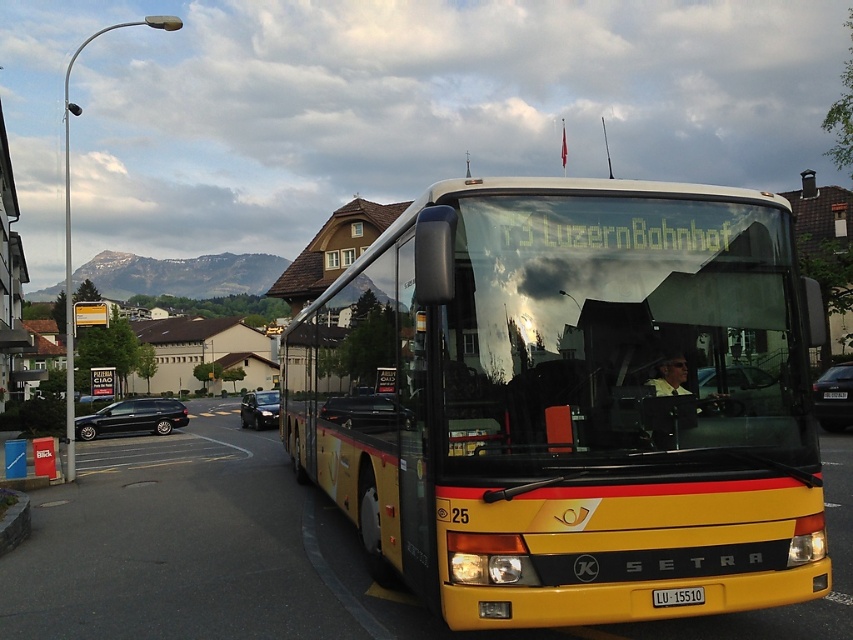
Between yellow matte bus at center and shiny black sedan at center, which one has less height?

shiny black sedan at center is shorter.

Between point (641, 490) and point (254, 428), which one is positioned in front?

Positioned in front is point (641, 490).

Where is `yellow matte bus at center`? The height and width of the screenshot is (640, 853). yellow matte bus at center is located at coordinates (566, 401).

Find the location of a particular element. This screenshot has height=640, width=853. yellow matte bus at center is located at coordinates (566, 401).

Is shiny black sedan at left wider than black glossy sedan at center?

Yes.

This screenshot has height=640, width=853. Describe the element at coordinates (132, 417) in the screenshot. I see `shiny black sedan at left` at that location.

What are the coordinates of `shiny black sedan at left` in the screenshot? It's located at point(132,417).

Who is taller, yellow matte license plate at center or white plastic license plate at center?

white plastic license plate at center is taller.

Does yellow matte license plate at center have a greater width compared to white plastic license plate at center?

No.

Which is in front, point (672, 588) or point (833, 397)?

Point (672, 588) is in front.

At what (x,y) coordinates should I click in order to perform the action: click on yellow matte license plate at center. Please return your answer as a coordinate pair (x, y). Looking at the image, I should click on (677, 596).